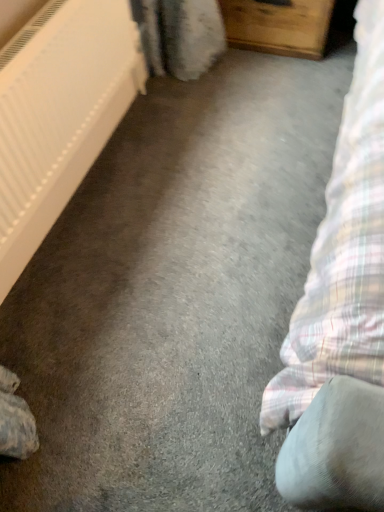
Question: Considering their positions, is wooden chest of drawers at upper center located in front of or behind white plastic radiator at left?

Choices:
 (A) behind
 (B) front

Answer: (A)

Question: Which is correct: wooden chest of drawers at upper center is inside white plastic radiator at left, or outside of it?

Choices:
 (A) inside
 (B) outside

Answer: (B)

Question: Considering the positions of wooden chest of drawers at upper center and white plastic radiator at left in the image, is wooden chest of drawers at upper center bigger or smaller than white plastic radiator at left?

Choices:
 (A) small
 (B) big

Answer: (A)

Question: Is point (144, 81) positioned closer to the camera than point (312, 15)?

Choices:
 (A) farther
 (B) closer

Answer: (A)

Question: Would you say white plastic radiator at left is inside or outside wooden chest of drawers at upper center?

Choices:
 (A) inside
 (B) outside

Answer: (B)

Question: Considering the positions of white plastic radiator at left and wooden chest of drawers at upper center in the image, is white plastic radiator at left wider or thinner than wooden chest of drawers at upper center?

Choices:
 (A) thin
 (B) wide

Answer: (A)

Question: Would you say white plastic radiator at left is to the left or to the right of wooden chest of drawers at upper center in the picture?

Choices:
 (A) left
 (B) right

Answer: (A)